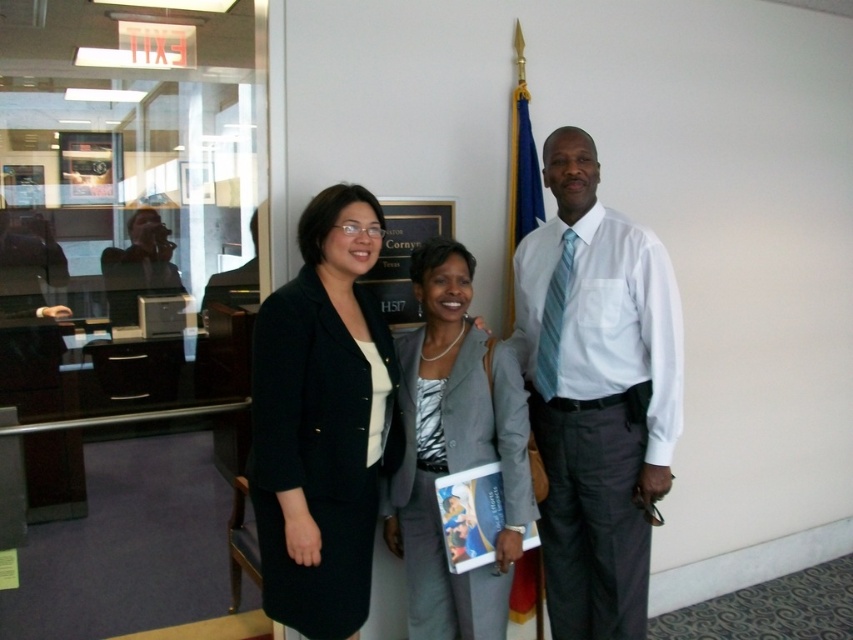
Is matte black blazer at center to the right of matte black laptop at left from the viewer's perspective?

Indeed, matte black blazer at center is positioned on the right side of matte black laptop at left.

The width and height of the screenshot is (853, 640). In order to click on matte black blazer at center in this screenshot , I will do `click(596, 394)`.

You are a GUI agent. You are given a task and a screenshot of the screen. Output one action in this format:
    pyautogui.click(x=<x>, y=<y>)
    Task: Click on the matte black blazer at center
    This screenshot has height=640, width=853.
    Given the screenshot: What is the action you would take?
    pyautogui.click(x=596, y=394)

What do you see at coordinates (596, 392) in the screenshot? I see `white glossy shirt at center` at bounding box center [596, 392].

Which of these two, white glossy shirt at center or black woolen blazer at center, stands taller?

A: white glossy shirt at center is taller.

The image size is (853, 640). What are the coordinates of `white glossy shirt at center` in the screenshot? It's located at (596, 392).

Image resolution: width=853 pixels, height=640 pixels. Find the location of `white glossy shirt at center`. white glossy shirt at center is located at coordinates (596, 392).

Which is behind, point (328, 502) or point (228, 276)?

The point (228, 276) is behind.

Can you confirm if black woolen blazer at center is positioned to the right of matte black laptop at left?

Yes, black woolen blazer at center is to the right of matte black laptop at left.

Locate an element on the screen. black woolen blazer at center is located at coordinates pos(318,451).

Identify the location of black woolen blazer at center. The width and height of the screenshot is (853, 640). (318, 451).